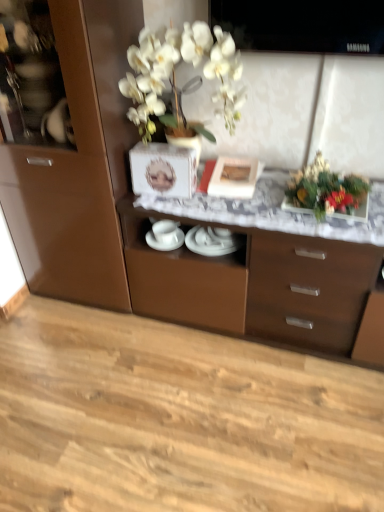
Question: Which direction should I rotate to face white glossy plates at center, which appears as the 1th tableware when viewed from the right, — up or down?

Choices:
 (A) up
 (B) down

Answer: (A)

Question: Is white glossy plates at center, acting as the 1th tableware starting from the left, taller than brown glossy cabinet at center?

Choices:
 (A) yes
 (B) no

Answer: (B)

Question: Can you confirm if white glossy plates at center, the 2th tableware from the right, is bigger than brown glossy cabinet at center?

Choices:
 (A) yes
 (B) no

Answer: (B)

Question: Are white glossy plates at center, acting as the 1th tableware starting from the left, and brown glossy cabinet at center located far from each other?

Choices:
 (A) yes
 (B) no

Answer: (B)

Question: Does white glossy plates at center, acting as the 1th tableware starting from the left, contain brown glossy cabinet at center?

Choices:
 (A) yes
 (B) no

Answer: (B)

Question: Is brown glossy cabinet at center at the back of white glossy plates at center, the 2th tableware from the right?

Choices:
 (A) no
 (B) yes

Answer: (B)

Question: Is white glossy plates at center, the 2th tableware from the right, to the left of brown glossy cabinet at center from the viewer's perspective?

Choices:
 (A) no
 (B) yes

Answer: (B)

Question: Is white glossy plates at center, positioned as the second tableware in left-to-right order, located outside matte white picture frame at center?

Choices:
 (A) yes
 (B) no

Answer: (A)

Question: Is white glossy plates at center, positioned as the second tableware in left-to-right order, at the right side of matte white picture frame at center?

Choices:
 (A) yes
 (B) no

Answer: (B)

Question: Can you confirm if white glossy plates at center, positioned as the second tableware in left-to-right order, is wider than matte white picture frame at center?

Choices:
 (A) yes
 (B) no

Answer: (B)

Question: Considering the relative sizes of white glossy plates at center, positioned as the second tableware in left-to-right order, and matte white picture frame at center in the image provided, is white glossy plates at center, positioned as the second tableware in left-to-right order, smaller than matte white picture frame at center?

Choices:
 (A) yes
 (B) no

Answer: (A)

Question: From the image's perspective, is white glossy plates at center, which appears as the 1th tableware when viewed from the right, under matte white picture frame at center?

Choices:
 (A) no
 (B) yes

Answer: (B)

Question: Is shiny metallic vase at upper right far away from brown glossy cabinet at center?

Choices:
 (A) no
 (B) yes

Answer: (A)